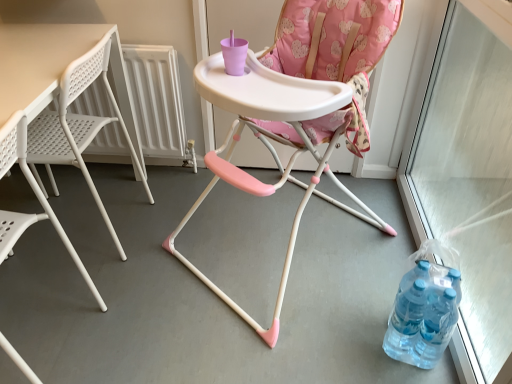
Where is `free point to the left of pink plastic highchair at center, positioned as the 1th chair in right-to-left order`? The height and width of the screenshot is (384, 512). free point to the left of pink plastic highchair at center, positioned as the 1th chair in right-to-left order is located at coordinates (147, 258).